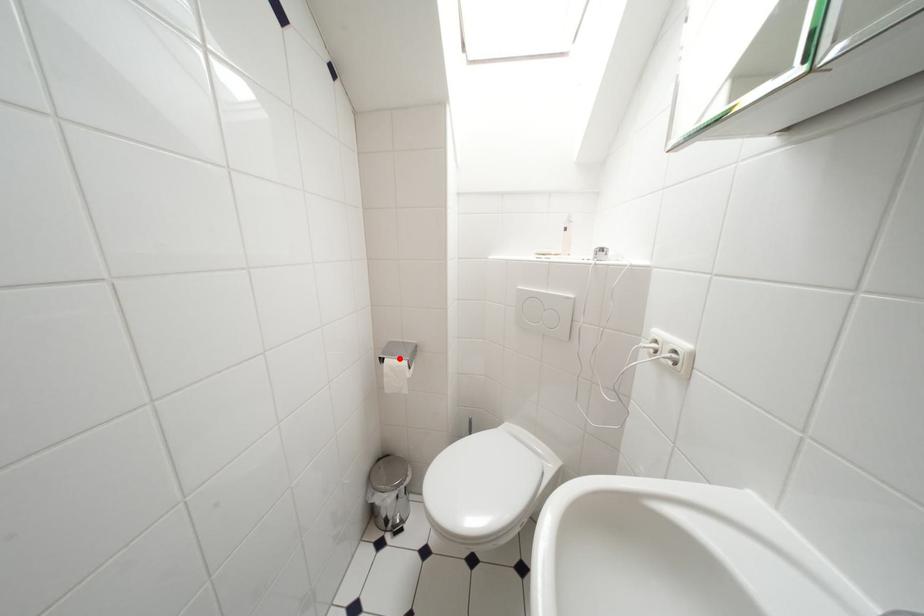
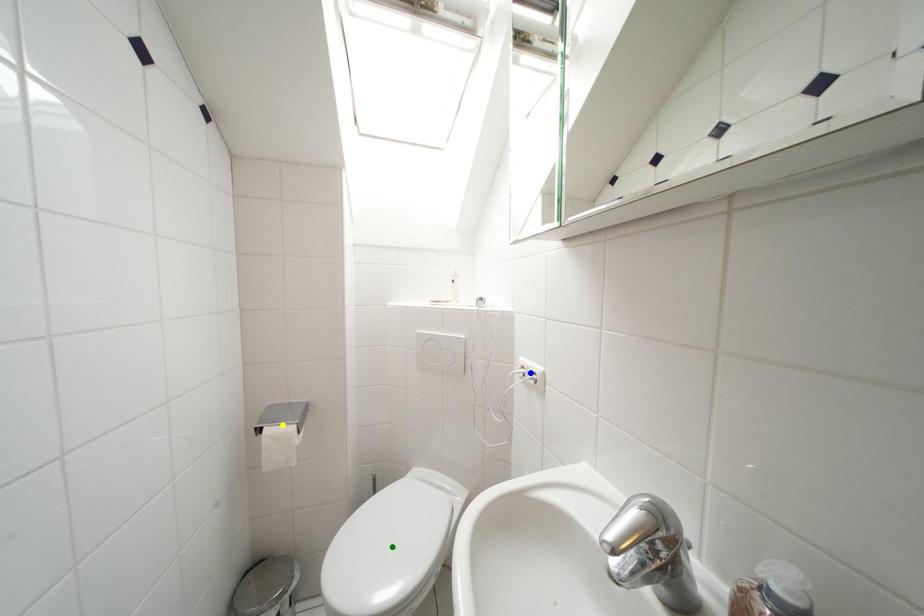
Question: I am providing you with two images of the same scene from different viewpoints. A red point is marked on the first image. You are given multiple points on the second image. Which point in image 2 is actually the same real-world point as the red point in image 1?

Choices:
 (A) blue point
 (B) yellow point
 (C) green point

Answer: (B)